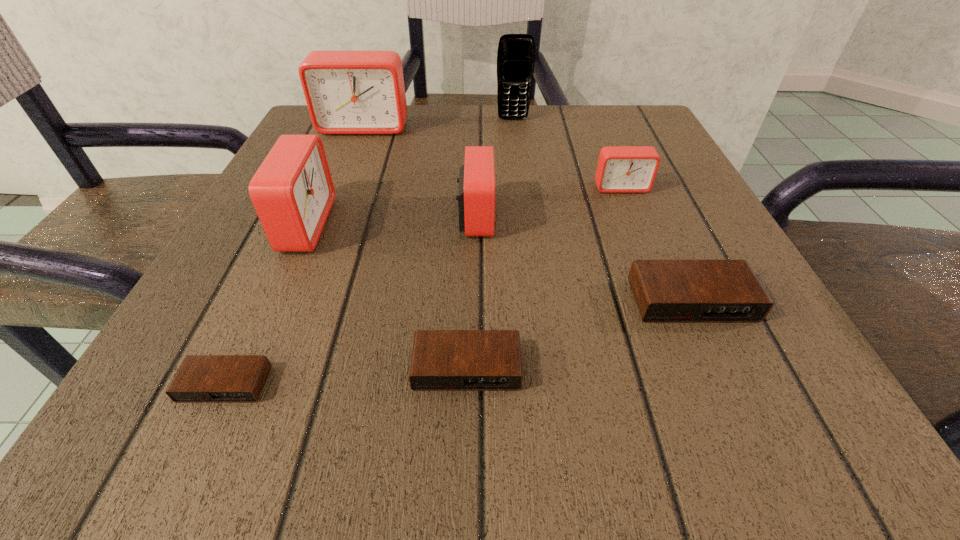
Where is `free space that satisfies the following two spatial constraints: 1. on the front-facing side of the fourth shortest alarm clock; 2. on the front-facing side of the second biggest red alarm clock`? free space that satisfies the following two spatial constraints: 1. on the front-facing side of the fourth shortest alarm clock; 2. on the front-facing side of the second biggest red alarm clock is located at coordinates (636, 225).